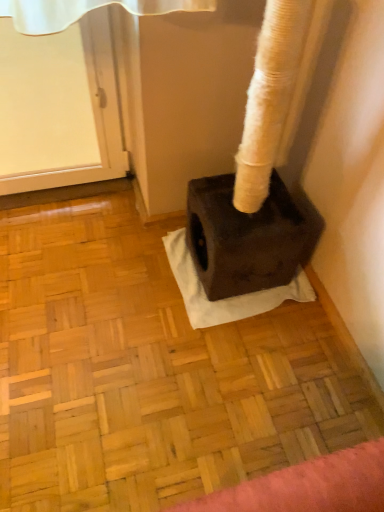
You are a GUI agent. You are given a task and a screenshot of the screen. Output one action in this format:
    pyautogui.click(x=<x>, y=<y>)
    Task: Click on the vacant region to the left of dark gray fabric at center
    
    Given the screenshot: What is the action you would take?
    point(119,274)